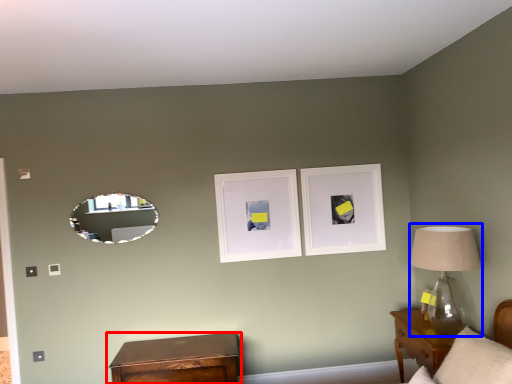
Question: Which point is closer to the camera, nightstand (highlighted by a red box) or table lamp (highlighted by a blue box)?

Choices:
 (A) nightstand
 (B) table lamp

Answer: (B)